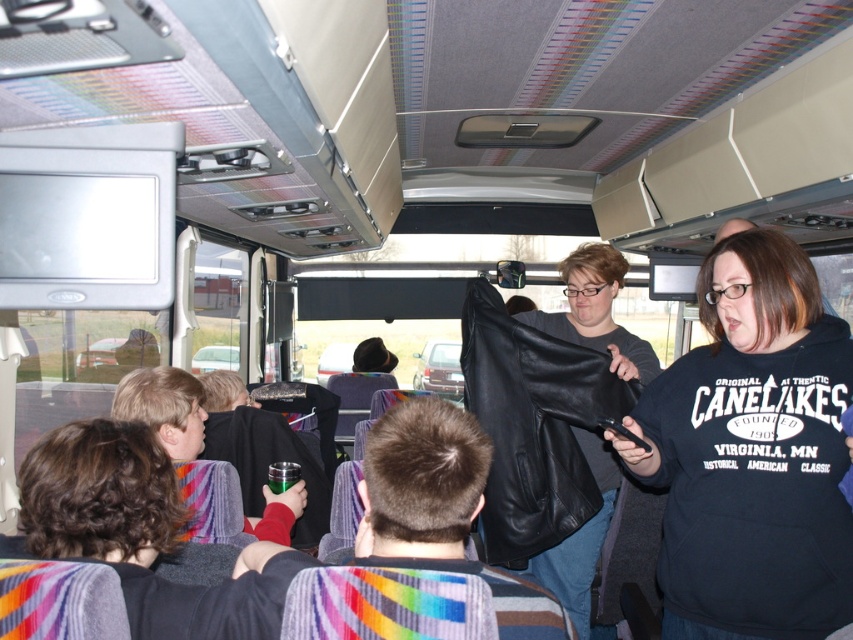
You are a tour guide standing in the middle of the bus. You need to hand out a map to both the person wearing the black matte sweatshirt at center and the person wearing the black leather jacket at center. Which person should you give the map to first to ensure they can easily reach it without bending down?

The black matte sweatshirt at center is much taller than the black leather jacket at center, so you should give the map to the person wearing the black matte sweatshirt at center first since they can reach it without bending down.

You are sitting in the front row of the bus and want to take a photo of both the point at coordinates point[717,508] and point[581,612]. Which point should you focus on first to ensure both are in clear view?

You should focus on point[717,508] first because it is closer to the camera than point[581,612], ensuring both points are in focus when using depth of field.

You are a passenger on a bus and want to find the point at coordinates (752, 452). According to the scene description, where exactly is this point located?

The point at coordinates (752, 452) is on the black matte sweatshirt at center.